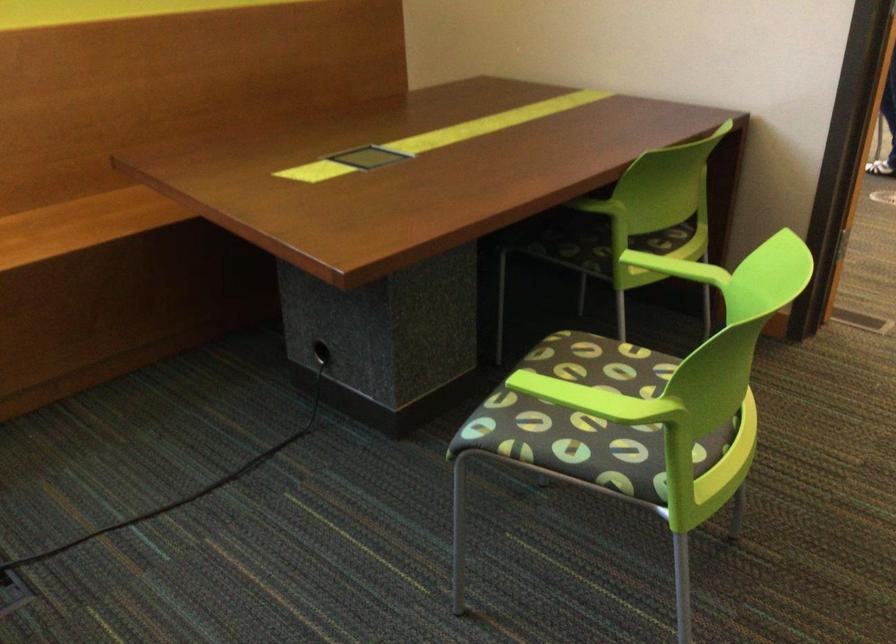
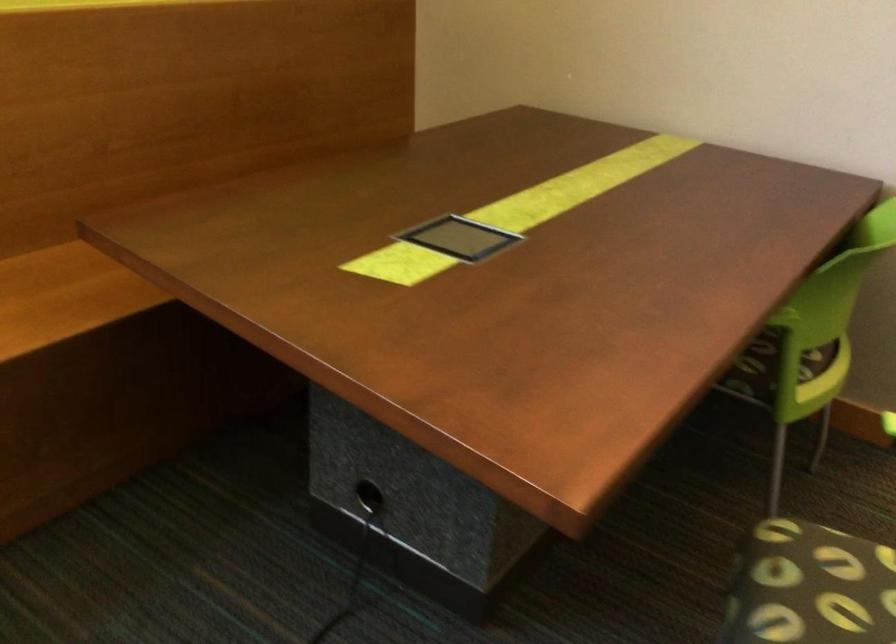
Where in the second image is the point corresponding to point (572, 365) from the first image?

(815, 587)